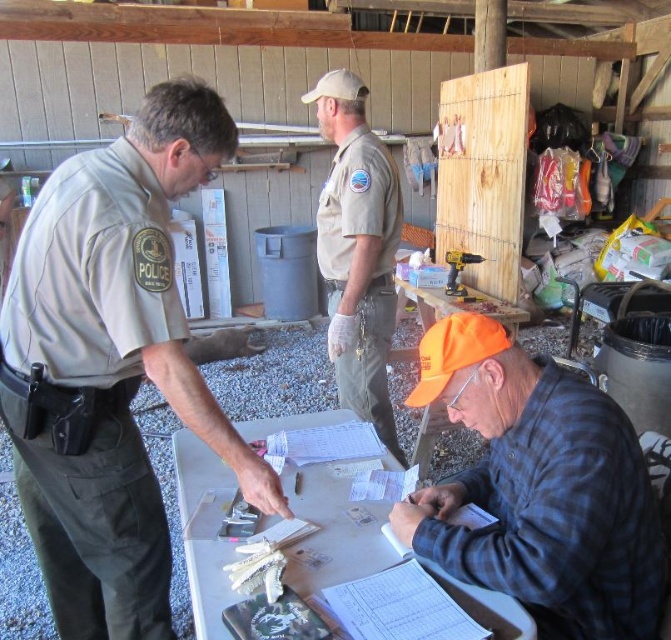
Which is below, white paper at center or black plastic drill at center?

Positioned lower is white paper at center.

Does white paper at center lie behind black plastic drill at center?

No, it is in front of black plastic drill at center.

Is point (340, 552) closer to viewer compared to point (454, 291)?

That is True.

Locate an element on the screen. white paper at center is located at coordinates (333, 529).

Consider the image. Which of these two, tan uniform at center or black plastic drill at center, stands shorter?

With less height is black plastic drill at center.

Is tan uniform at center positioned behind black plastic drill at center?

No, tan uniform at center is in front of black plastic drill at center.

The height and width of the screenshot is (640, 671). Describe the element at coordinates (358, 250) in the screenshot. I see `tan uniform at center` at that location.

The image size is (671, 640). Identify the location of tan uniform at center. (x=358, y=250).

Does tan uniform at left have a lesser height compared to tan uniform at center?

Correct, tan uniform at left is not as tall as tan uniform at center.

Is tan uniform at left to the left of tan uniform at center from the viewer's perspective?

Yes, tan uniform at left is to the left of tan uniform at center.

Is point (160, 148) closer to viewer compared to point (338, 118)?

Yes, point (160, 148) is in front of point (338, 118).

Find the location of a particular element. Image resolution: width=671 pixels, height=640 pixels. tan uniform at left is located at coordinates (111, 365).